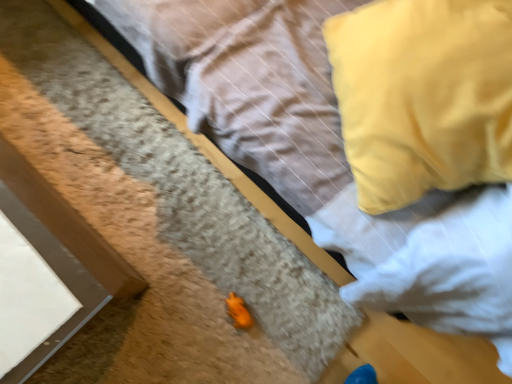
The width and height of the screenshot is (512, 384). I want to click on vacant area situated to the left side of orange matte toy frog at lower center, so click(x=190, y=281).